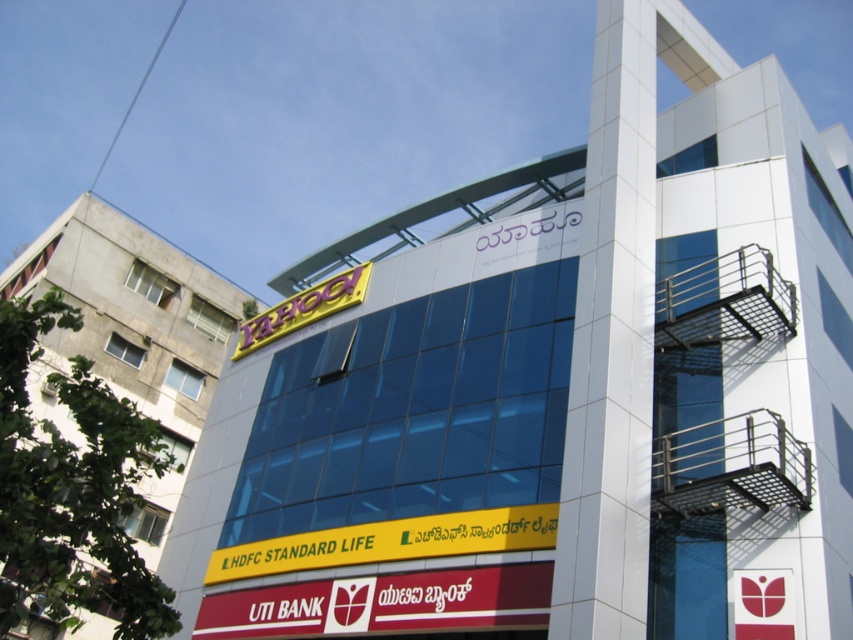
You are a delivery person trying to locate the Yahoo office. You see the yellow glossy sign at upper left and the yellow plastic yahoo! sign at upper center. Which sign is positioned higher up on the building?

The yellow glossy sign at upper left is positioned higher up on the building than the yellow plastic yahoo! sign at upper center.

You are a window cleaner working on the modern building. You need to clean the yellow glossy sign at upper left and the yellow plastic yahoo! sign at upper center. Which sign will require you to use a longer ladder due to its greater width?

The yellow glossy sign at upper left has a larger width than the yellow plastic yahoo! sign at upper center, so you will need a longer ladder to clean the yellow glossy sign at upper left.

Looking at this image, you are a window cleaner standing on a platform that can only move horizontally. You need to clean both the yellow glossy sign at upper left and the yellow plastic yahoo! sign at upper center. Which sign should you clean first to avoid having to move the platform again?

You should clean the yellow glossy sign at upper left first because the yellow plastic yahoo! sign at upper center is behind it. By cleaning the front sign first, you can then reach the one behind without needing to reposition the platform.